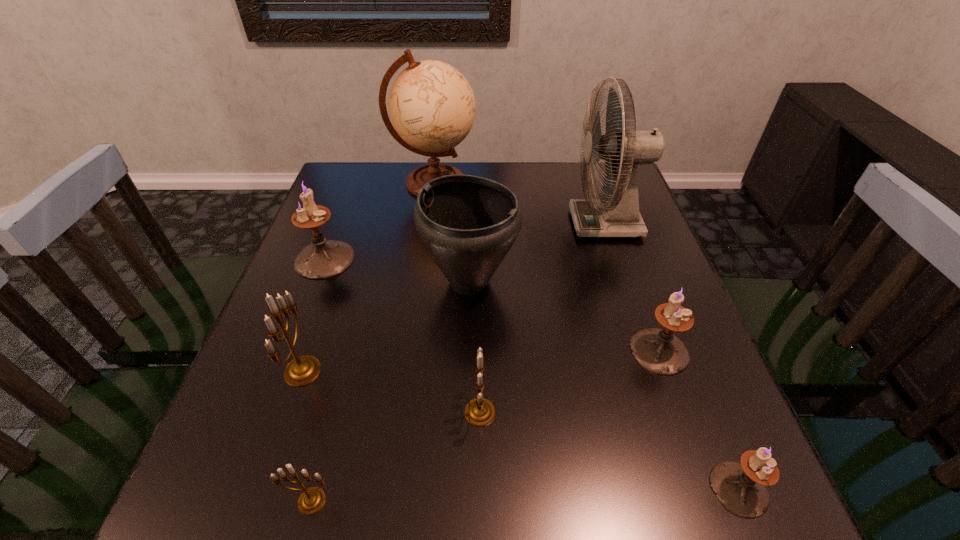
Image resolution: width=960 pixels, height=540 pixels. I want to click on globe, so click(x=432, y=107).

Where is `fan`? The width and height of the screenshot is (960, 540). fan is located at coordinates (619, 216).

At what (x,y) coordinates should I click in order to perform the action: click on urn. Please return your answer as a coordinate pair (x, y). Image resolution: width=960 pixels, height=540 pixels. Looking at the image, I should click on (468, 224).

Where is `the farthest purple candle holder`? the farthest purple candle holder is located at coordinates (324, 258).

This screenshot has width=960, height=540. In order to click on the biggest purple candle holder in this screenshot , I will do `click(324, 258)`.

Image resolution: width=960 pixels, height=540 pixels. Identify the location of the biggest gold candelabrum. (303, 370).

Identify the location of the second smallest purple candle holder. This screenshot has height=540, width=960. (659, 351).

Identify the location of the rightmost gold candelabrum. This screenshot has width=960, height=540. (479, 412).

Where is `the second smallest gold candelabrum`? Image resolution: width=960 pixels, height=540 pixels. the second smallest gold candelabrum is located at coordinates (479, 412).

The width and height of the screenshot is (960, 540). Identify the location of the nearest gold candelabrum. [x=312, y=499].